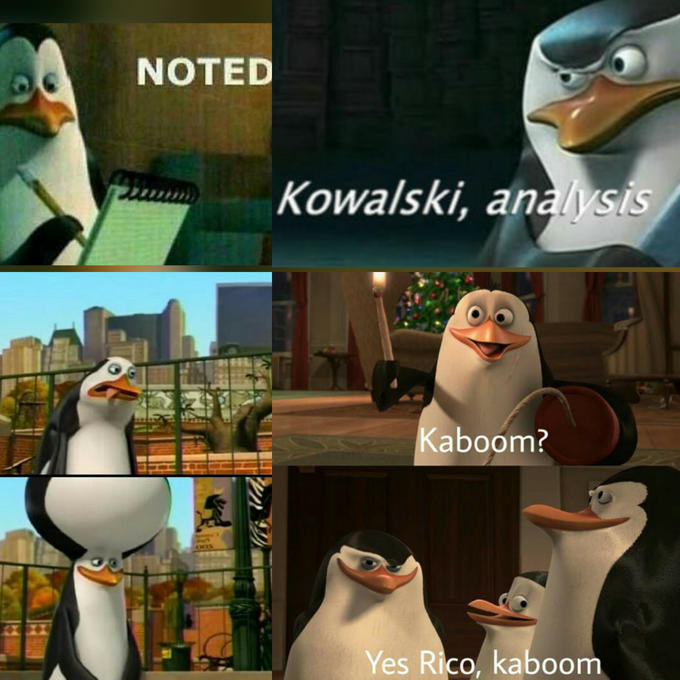
At what (x,y) coordinates should I click in order to perform the action: click on christmas tree. Please return your answer as a coordinate pair (x, y). This screenshot has height=680, width=680. Looking at the image, I should click on (443, 306).